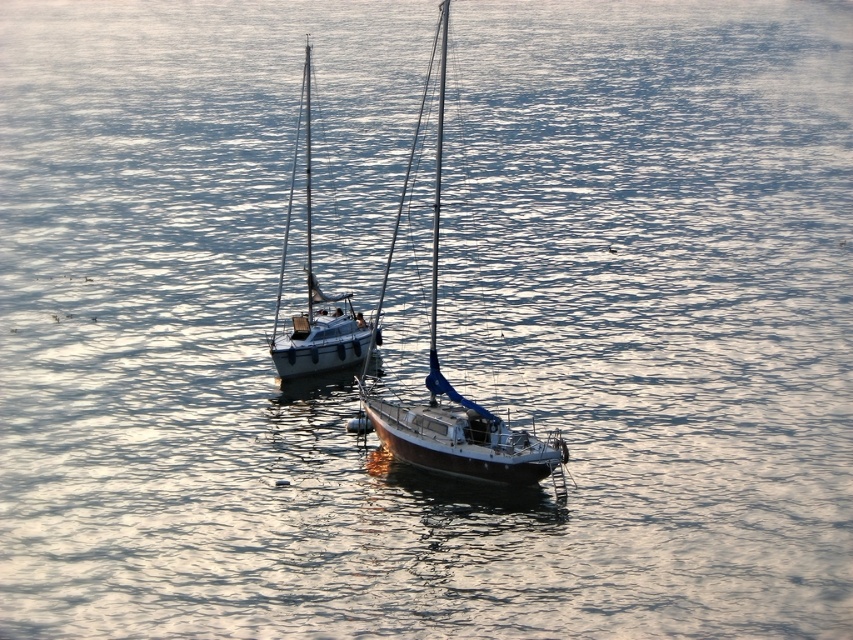
Question: Among these objects, which one is nearest to the camera?

Choices:
 (A) blue glossy mast at center
 (B) wooden sailboat at center
 (C) white glossy sailboat at center

Answer: (B)

Question: Which of the following is the farthest from the observer?

Choices:
 (A) (480, 460)
 (B) (432, 321)

Answer: (B)

Question: Does white glossy sailboat at center lie behind blue glossy mast at center?

Choices:
 (A) yes
 (B) no

Answer: (A)

Question: Is white glossy sailboat at center further to camera compared to blue glossy mast at center?

Choices:
 (A) yes
 (B) no

Answer: (A)

Question: Is wooden sailboat at center closer to the viewer compared to white glossy sailboat at center?

Choices:
 (A) yes
 (B) no

Answer: (A)

Question: Which point is closer to the camera taking this photo?

Choices:
 (A) (306, 337)
 (B) (436, 301)

Answer: (B)